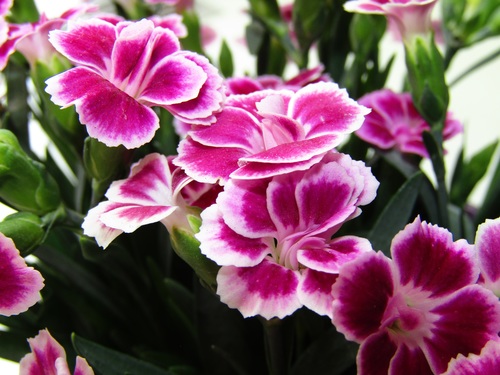
This screenshot has height=375, width=500. Identify the location of light green flower holders. (423, 52), (407, 52), (435, 47), (177, 233), (199, 222).